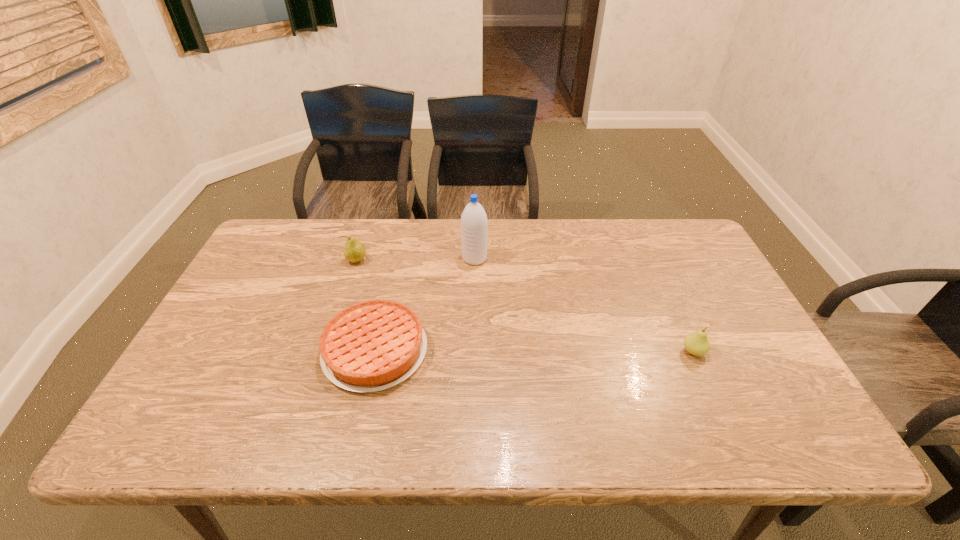
Image resolution: width=960 pixels, height=540 pixels. Identify the location of water bottle present at the far edge. [x=474, y=224].

Locate an element on the screen. This screenshot has width=960, height=540. pear at the far edge is located at coordinates (354, 251).

Locate an element on the screen. Image resolution: width=960 pixels, height=540 pixels. object located in the right edge section of the desktop is located at coordinates (697, 343).

At what (x,y) coordinates should I click in order to perform the action: click on vacant space at the far edge of the desktop. Please return your answer as a coordinate pair (x, y). Looking at the image, I should click on (360, 230).

In the image, there is a desktop. At what (x,y) coordinates should I click in order to perform the action: click on vacant space at the near edge. Please return your answer as a coordinate pair (x, y). Looking at the image, I should click on (421, 438).

You are a GUI agent. You are given a task and a screenshot of the screen. Output one action in this format:
    pyautogui.click(x=<x>, y=<y>)
    Task: Click on the vacant space at the right edge of the desktop
    The image size is (960, 540).
    Given the screenshot: What is the action you would take?
    tap(672, 284)

I want to click on vacant space at the far left corner of the desktop, so click(269, 262).

The width and height of the screenshot is (960, 540). I want to click on free space at the near left corner, so click(x=169, y=420).

In order to click on vacant space at the far right corner in this screenshot , I will do `click(677, 259)`.

This screenshot has height=540, width=960. What are the coordinates of `free spot between the nearer pear and the farther pear` in the screenshot? It's located at (525, 306).